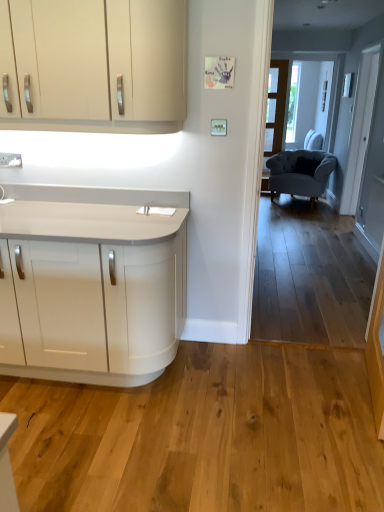
Where is `vacant area that is in front of white glossy countertop at lower left`? The height and width of the screenshot is (512, 384). vacant area that is in front of white glossy countertop at lower left is located at coordinates (86, 438).